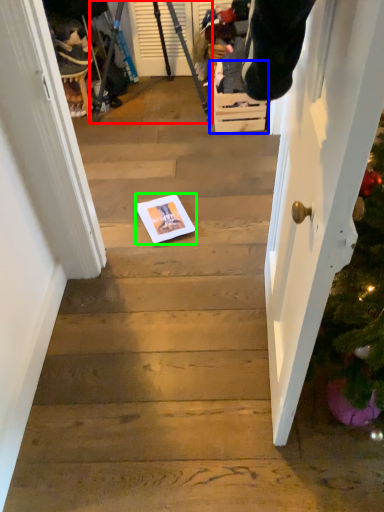
Question: Which is farther away from tripod (highlighted by a red box)? drawer (highlighted by a blue box) or copy (highlighted by a green box)?

Choices:
 (A) drawer
 (B) copy

Answer: (B)